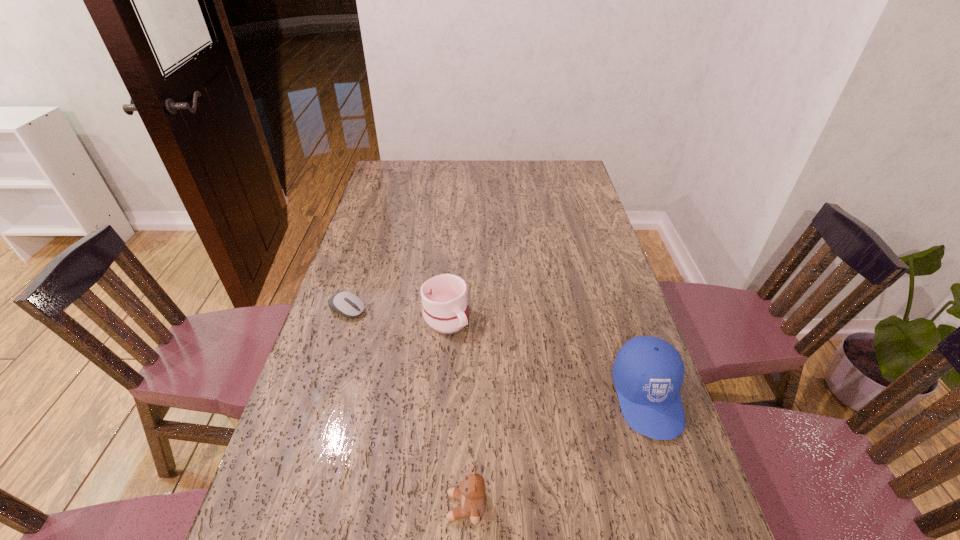
Find the location of `vacant space located on the side with the handle of the mug`. vacant space located on the side with the handle of the mug is located at coordinates click(x=479, y=369).

What are the coordinates of `free space located on the side with the handle of the mug` in the screenshot? It's located at click(493, 388).

Identify the location of free region located on the side with the handle of the mug. [522, 430].

Where is `vacant space positioned on the wheel side of the leftmost object`? Image resolution: width=960 pixels, height=540 pixels. vacant space positioned on the wheel side of the leftmost object is located at coordinates (422, 345).

You are a GUI agent. You are given a task and a screenshot of the screen. Output one action in this format:
    pyautogui.click(x=<x>, y=<y>)
    Task: Click on the free space located 0.400m on the wheel side of the leftmost object
    This screenshot has width=960, height=540.
    Given the screenshot: What is the action you would take?
    pyautogui.click(x=478, y=373)

Locate an element on the screen. vacant point located on the wheel side of the leftmost object is located at coordinates (414, 341).

Where is `object that is positioned at the near edge`? object that is positioned at the near edge is located at coordinates (470, 492).

This screenshot has width=960, height=540. I want to click on object that is at the left edge, so click(347, 304).

The image size is (960, 540). In order to click on object that is positioned at the right edge in this screenshot , I will do `click(648, 372)`.

This screenshot has height=540, width=960. In the image, there is a desktop. What are the coordinates of `free region at the far edge` in the screenshot? It's located at (455, 163).